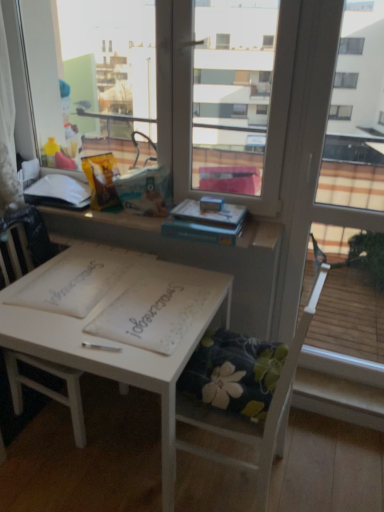
At what (x,y) coordinates should I click in order to perform the action: click on free space above white plastic window sill at lower right (from a real-world perspective). Please return your answer as a coordinate pair (x, y). The width and height of the screenshot is (384, 512). Looking at the image, I should click on pos(349,386).